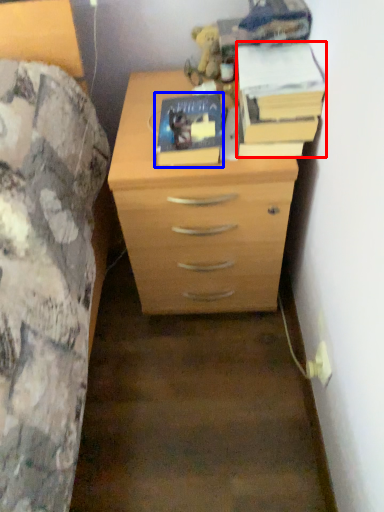
Question: Which object is closer to the camera taking this photo, paperback book (highlighted by a red box) or paperback book (highlighted by a blue box)?

Choices:
 (A) paperback book
 (B) paperback book

Answer: (A)